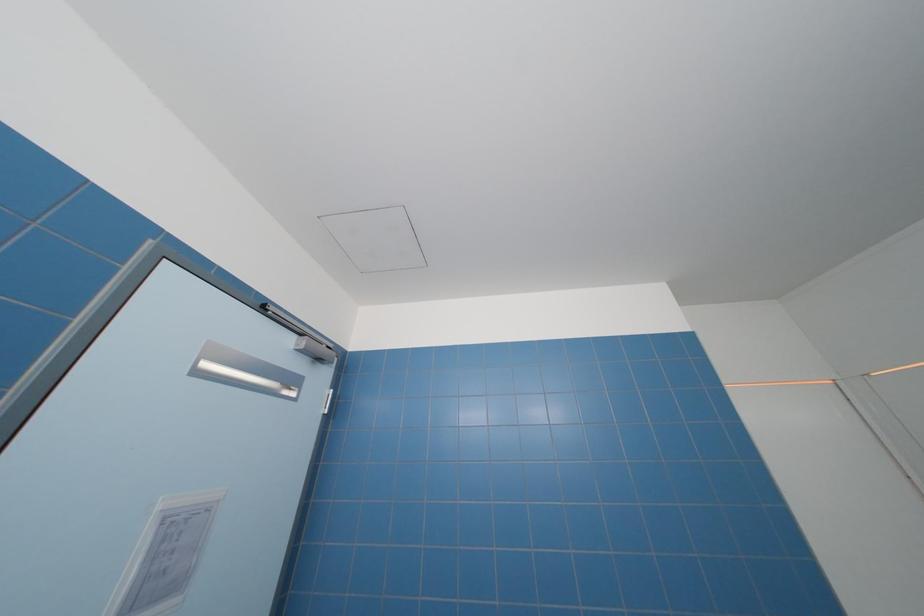
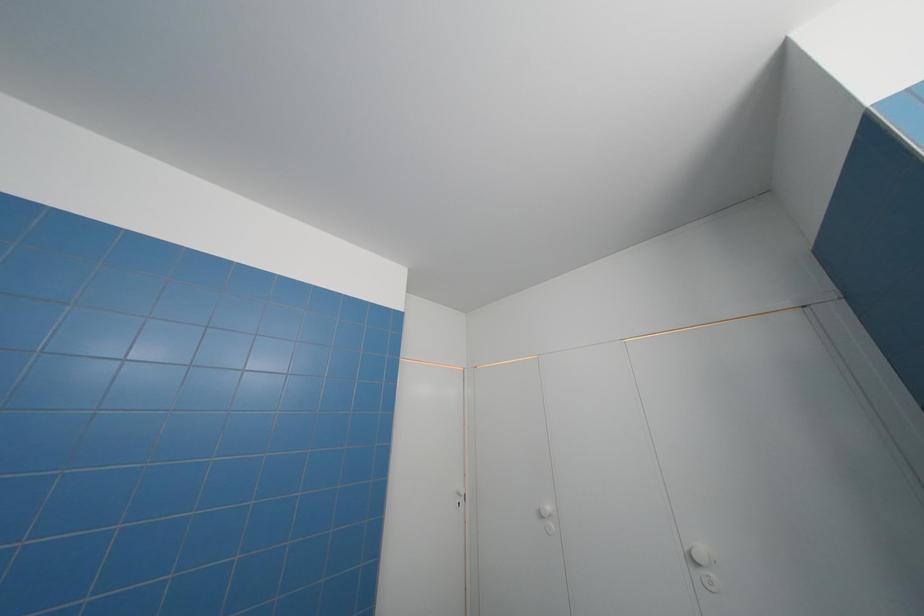
Question: The camera is either moving clockwise (left) or counter-clockwise (right) around the object. The first image is from the beginning of the video and the second image is from the end. Is the camera moving left or right when shooting the video?

Choices:
 (A) Left
 (B) Right

Answer: (A)